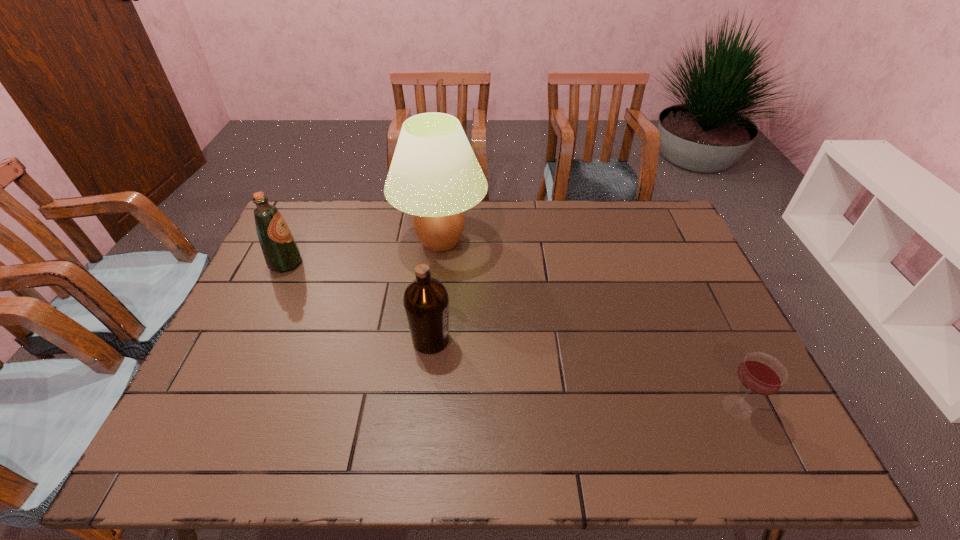
Where is `vacant space located 0.310m on the left of the nearest object`? The width and height of the screenshot is (960, 540). vacant space located 0.310m on the left of the nearest object is located at coordinates (588, 407).

The image size is (960, 540). I want to click on object that is at the far edge, so click(434, 175).

I want to click on object located at the left edge, so click(281, 253).

The width and height of the screenshot is (960, 540). In order to click on object present at the right edge in this screenshot , I will do `click(760, 373)`.

The height and width of the screenshot is (540, 960). In the image, there is a desktop. Identify the location of free space at the far edge. (607, 222).

In the image, there is a desktop. Where is `vacant space at the near edge`? vacant space at the near edge is located at coordinates (401, 452).

Where is `vacant space at the left edge of the desktop`? vacant space at the left edge of the desktop is located at coordinates (250, 333).

The width and height of the screenshot is (960, 540). Identify the location of free location at the right edge of the desktop. (680, 333).

The height and width of the screenshot is (540, 960). Identify the location of free space at the near left corner of the desktop. (190, 447).

The image size is (960, 540). Identify the location of vacant space at the far right corner of the desktop. (662, 226).